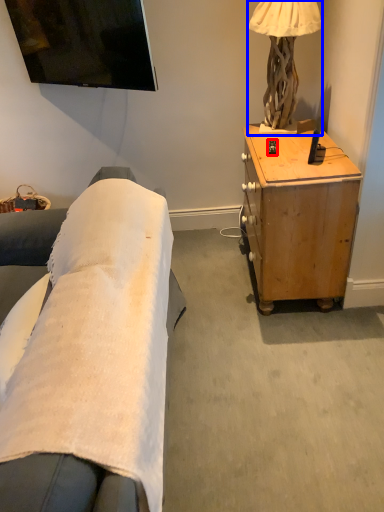
Question: Which of the following is the closest to the observer, remote control (highlighted by a red box) or lamp (highlighted by a blue box)?

Choices:
 (A) remote control
 (B) lamp

Answer: (B)